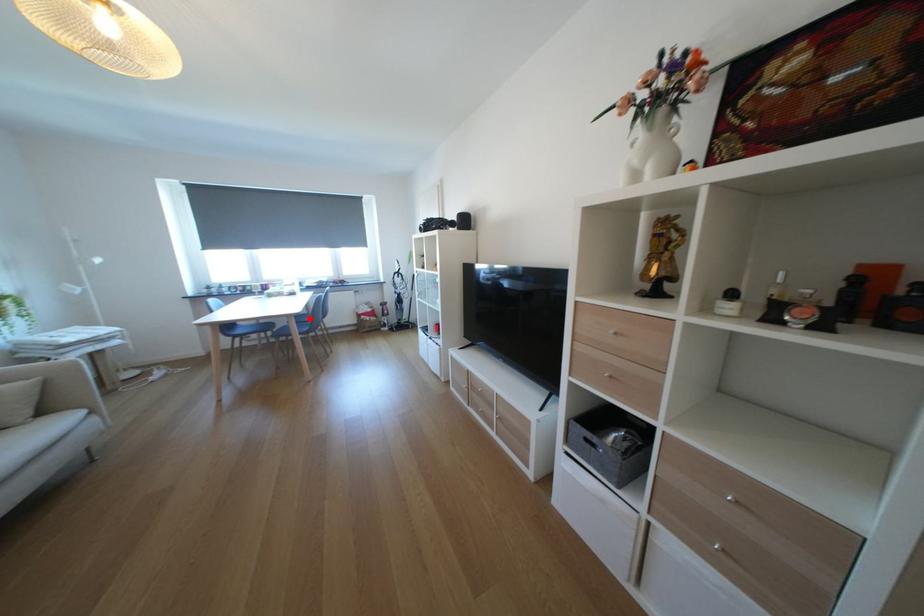
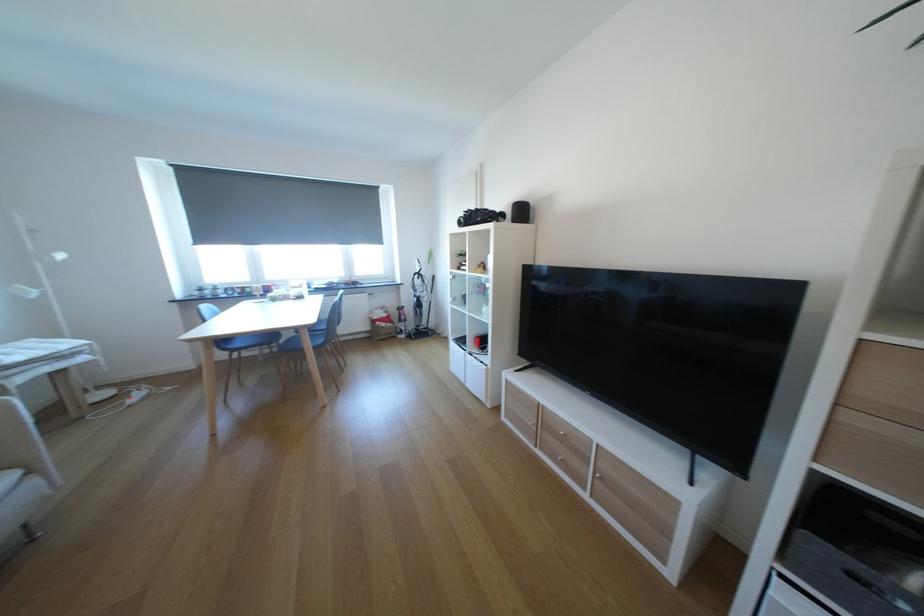
Question: I am providing you with two images of the same scene from different viewpoints. A red point is marked on the first image. At the location where the point appears in image 1, is it still visible in image 2?

Choices:
 (A) Yes
 (B) No

Answer: (A)